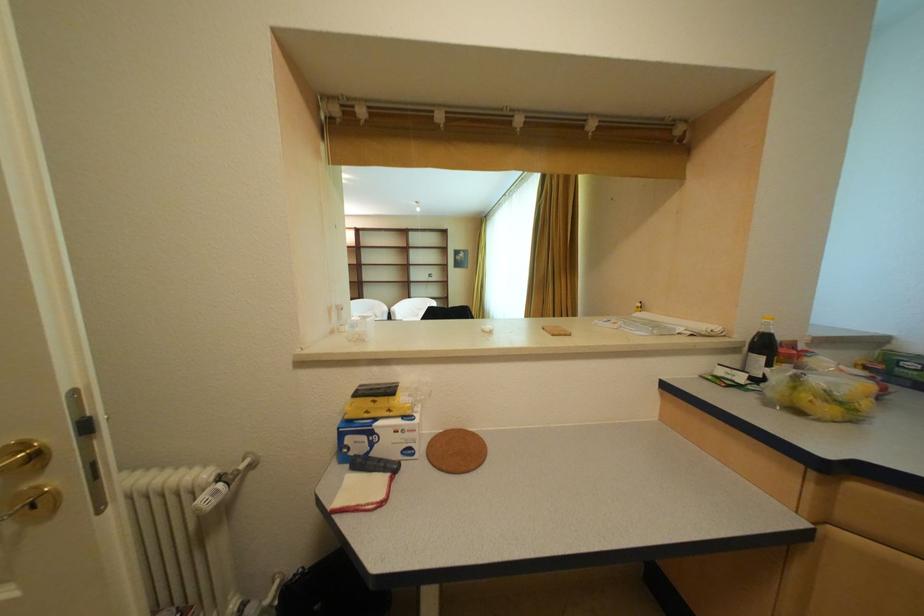
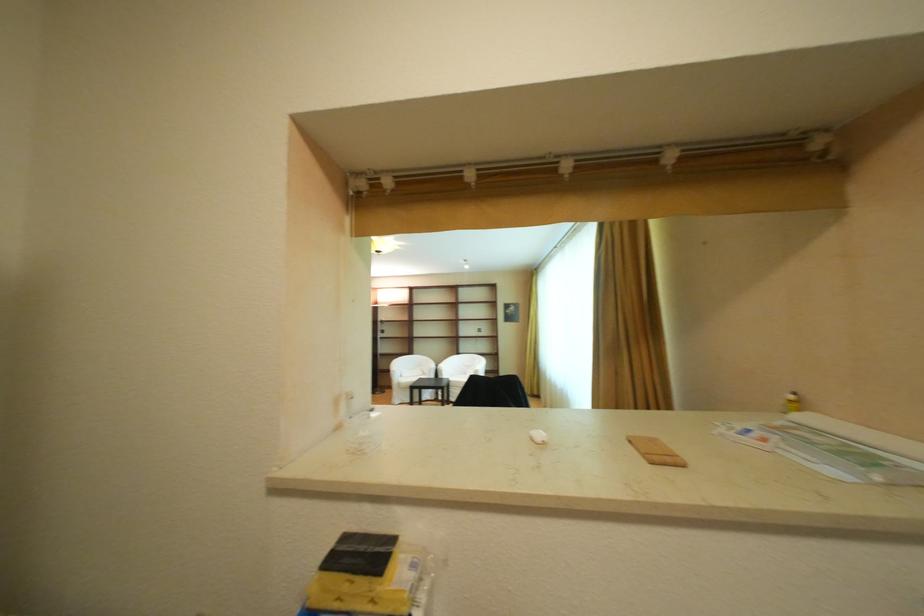
Question: The images are taken continuously from a first-person perspective. In which direction are you moving?

Choices:
 (A) Left
 (B) Right
 (C) Forward
 (D) Backward

Answer: (C)